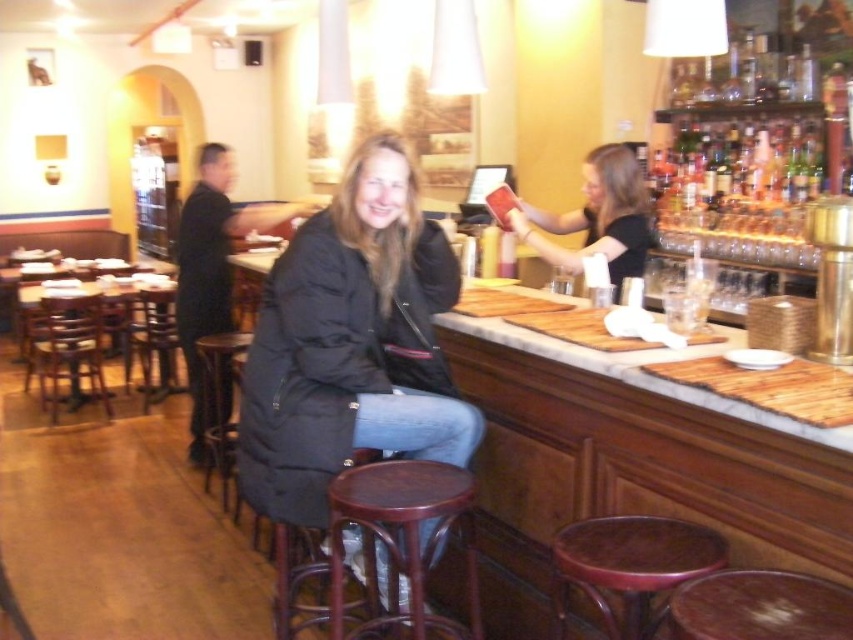
Between point (369, 408) and point (622, 154), which one is positioned behind?

Point (622, 154)

Which of these two, black matte jacket at center or matte black jacket at upper right, stands taller?

black matte jacket at center

Which is in front, point (264, 323) or point (645, 192)?

Point (264, 323) is more forward.

The image size is (853, 640). Find the location of `black matte jacket at center`. black matte jacket at center is located at coordinates (351, 342).

Is mahogany wood bar stool at center below wooden stool at lower center?

Yes.

The width and height of the screenshot is (853, 640). Describe the element at coordinates (403, 536) in the screenshot. I see `mahogany wood bar stool at center` at that location.

The image size is (853, 640). Identify the location of mahogany wood bar stool at center. (403, 536).

Locate an element on the screen. mahogany wood bar stool at center is located at coordinates (403, 536).

Between point (424, 604) and point (190, 236), which one is positioned behind?

The point (190, 236) is more distant.

Is mahogany wood bar stool at center wider than black uniform at left?

No, mahogany wood bar stool at center is not wider than black uniform at left.

At what (x,y) coordinates should I click in order to perform the action: click on mahogany wood bar stool at center. Please return your answer as a coordinate pair (x, y). This screenshot has width=853, height=640. Looking at the image, I should click on (403, 536).